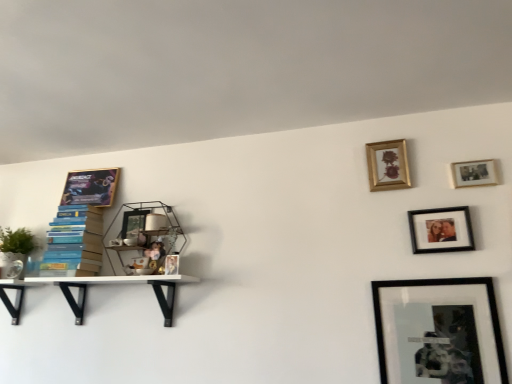
Question: Visually, is wooden photo frame at upper right, the 3th picture frame in the front-to-back sequence, positioned to the left or to the right of metallic wire shelf at upper center, the third shelf when ordered from left to right?

Choices:
 (A) left
 (B) right

Answer: (B)

Question: In terms of height, does wooden photo frame at upper right, which appears as the 4th picture frame when viewed from the back, look taller or shorter compared to metallic wire shelf at upper center, the third shelf when ordered from left to right?

Choices:
 (A) short
 (B) tall

Answer: (A)

Question: Estimate the real-world distances between objects in this image. Which object is closer to the metallic wire shelf at upper center, the third shelf when ordered from left to right?

Choices:
 (A) metallic glass picture frame at left, which ranks as the fifth picture frame in right-to-left order
 (B) white matte shelf at left, the 2th shelf positioned from the right
 (C) black matte picture frame at lower right, which ranks as the fourth picture frame in left-to-right order
 (D) matte black picture frame at upper right, positioned as the fifth picture frame in left-to-right order
 (E) wooden photo frame at upper right, which appears as the 4th picture frame when viewed from the back

Answer: (A)

Question: Estimate the real-world distances between objects in this image. Which object is farther from the white matte shelf at left, the 2th shelf positioned from the right?

Choices:
 (A) gold-framed poster at upper left, which is counted as the 1th picture frame, starting from the left
 (B) gold/glass picture frame at upper right, which is the 4th picture frame in right-to-left order
 (C) matte black picture frame at upper right, positioned as the 5th picture frame in back-to-front order
 (D) metallic glass picture frame at left, arranged as the second picture frame when viewed from the back
 (E) black matte picture frame at lower right, positioned as the 3th picture frame in right-to-left order

Answer: (C)